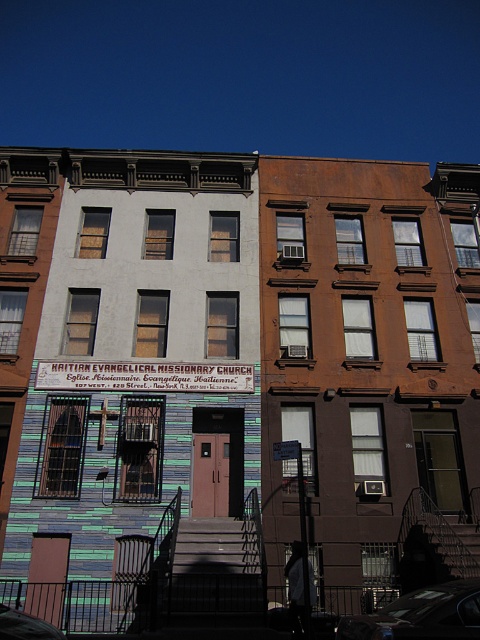
Question: Which of the following is the closest to the observer?

Choices:
 (A) (357, 621)
 (B) (196, 380)

Answer: (A)

Question: Is metallic silver sign at center above metallic car at lower right?

Choices:
 (A) no
 (B) yes

Answer: (B)

Question: Is metallic silver sign at center smaller than metallic car at lower right?

Choices:
 (A) yes
 (B) no

Answer: (A)

Question: Which of the following is the farthest from the observer?

Choices:
 (A) metallic silver sign at center
 (B) metallic car at lower right

Answer: (A)

Question: Does metallic silver sign at center have a smaller size compared to metallic car at lower right?

Choices:
 (A) no
 (B) yes

Answer: (B)